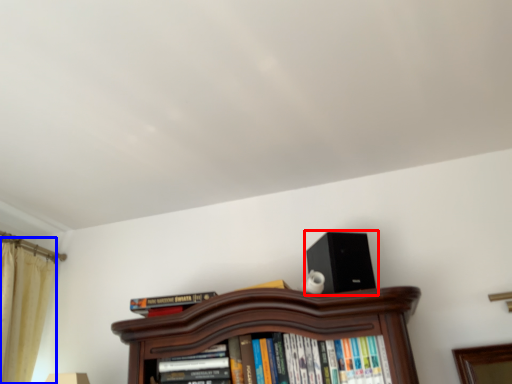
Question: Among these objects, which one is farthest to the camera, loudspeaker (highlighted by a red box) or curtain (highlighted by a blue box)?

Choices:
 (A) loudspeaker
 (B) curtain

Answer: (B)